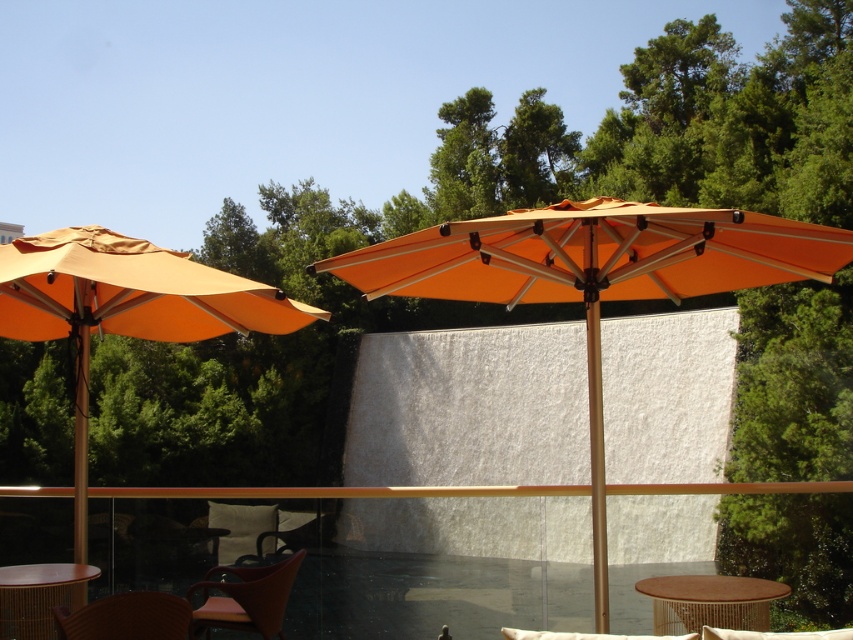
Question: From the image, what is the correct spatial relationship of brown woven table at center in relation to wooden table at lower left?

Choices:
 (A) right
 (B) left

Answer: (A)

Question: Is orange fabric umbrella at center wider than orange fabric umbrella at left?

Choices:
 (A) no
 (B) yes

Answer: (B)

Question: Estimate the real-world distances between objects in this image. Which object is farther from the brown woven chair at lower left?

Choices:
 (A) orange fabric umbrella at center
 (B) matte brown chair at lower left
 (C) brown woven table at center
 (D) wooden table at lower left

Answer: (C)

Question: Which object appears farthest from the camera in this image?

Choices:
 (A) wooden table at lower left
 (B) brown woven chair at lower left
 (C) orange fabric umbrella at left
 (D) orange fabric umbrella at center

Answer: (C)

Question: Which object appears closest to the camera in this image?

Choices:
 (A) matte brown chair at lower left
 (B) brown woven chair at lower left

Answer: (A)

Question: Does orange fabric umbrella at left come in front of brown woven table at center?

Choices:
 (A) no
 (B) yes

Answer: (A)